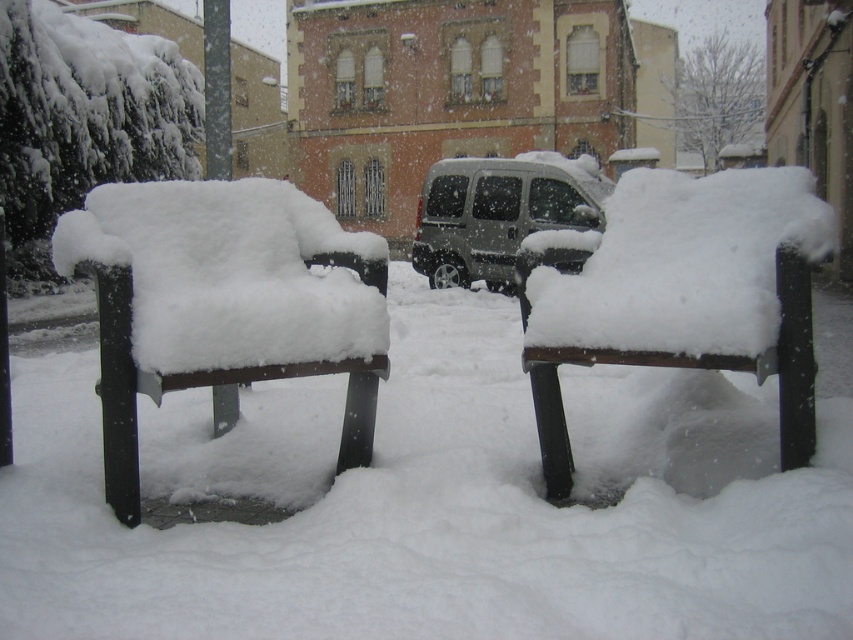
You are a photographer trying to capture the snowy scene. You want to focus on the wooden park bench at center and the metallic silver van at center. Which object should you adjust your camera focus to first if you want to ensure both are in focus, considering their distances from you?

The wooden park bench at center is closer to the viewer than the metallic silver van at center, so you should focus on the bench first to ensure both are in focus.

You are a delivery person trying to park your motorcycle between the wooden park bench at center and the metallic silver van at center. Can your motorcycle fit in the space between them?

The wooden park bench at center is thinner than the metallic silver van at center, so the space between them may be sufficient for the motorcycle to fit. However, the exact width of the space isn not provided, so it depends on the motorcycle size.

You are standing at the point labeled as point (222, 301) in the image. What object is located exactly at that coordinate?

The wooden park bench at left is located exactly at point (222, 301).